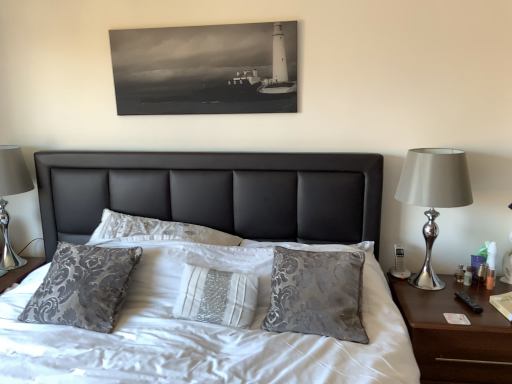
Find the location of a particular element. The width and height of the screenshot is (512, 384). vacant space in silver metallic lamp at right (from a real-world perspective) is located at coordinates [x=440, y=290].